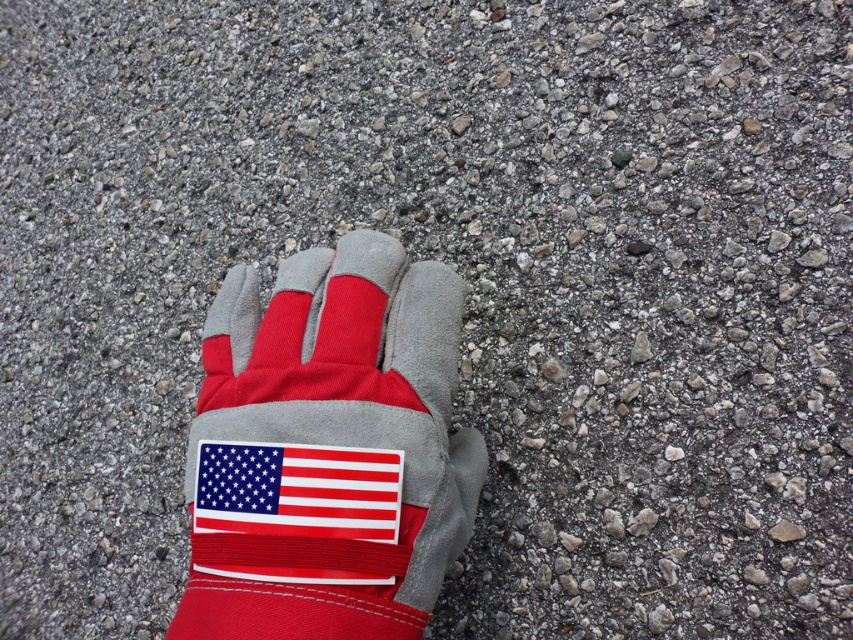
Question: Where is red fabric/glove at center located in relation to red fabric flag at center in the image?

Choices:
 (A) below
 (B) above

Answer: (B)

Question: Is the position of red fabric/glove at center more distant than that of red fabric flag at center?

Choices:
 (A) no
 (B) yes

Answer: (A)

Question: Which of the following is the closest to the observer?

Choices:
 (A) red fabric/glove at center
 (B) red fabric flag at center

Answer: (A)

Question: Which point is closer to the camera taking this photo?

Choices:
 (A) [364, 572]
 (B) [363, 468]

Answer: (A)

Question: Can you confirm if red fabric/glove at center is positioned to the right of red fabric flag at center?

Choices:
 (A) yes
 (B) no

Answer: (A)